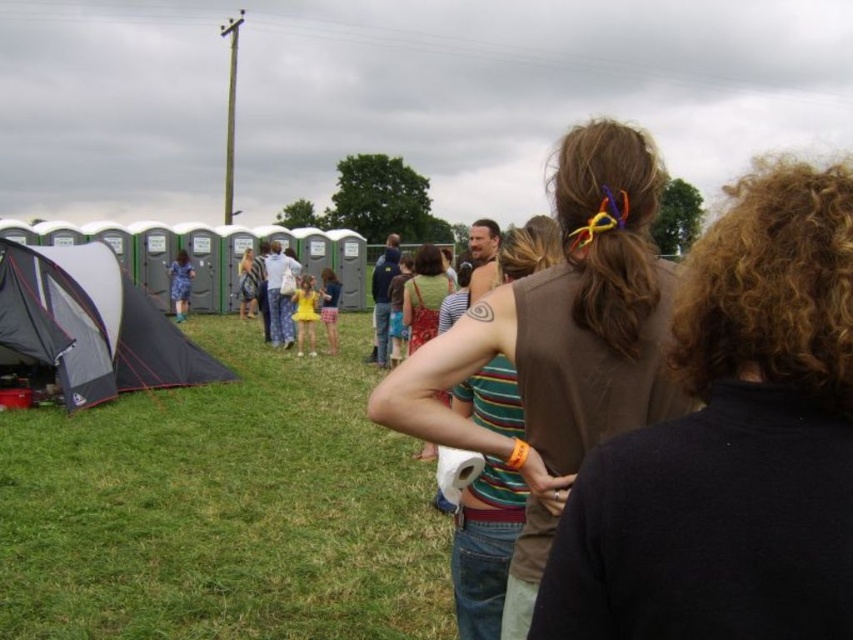
You are standing at the point marked as point (560, 342). Looking around, you see a brown fabric shirt at center and a row of gray portable toilets with green accents. Which object is closer to your current position?

The brown fabric shirt at center is located at point (560, 342), so you are exactly where the brown fabric shirt at center is positioned. Therefore, you are at the same location as the brown fabric shirt at center.

Based on the photo, you are a photographer positioned behind the people at the festival. You want to capture a clear photo of the brown fabric shirt at center without the brown hair at center blocking it. What should you do?

The brown hair at center is in front of the brown fabric shirt at center, so to capture a clear photo of the brown fabric shirt at center without the brown hair blocking it, you should move the brown hair at center out of the way or adjust your angle to avoid the obstruction.